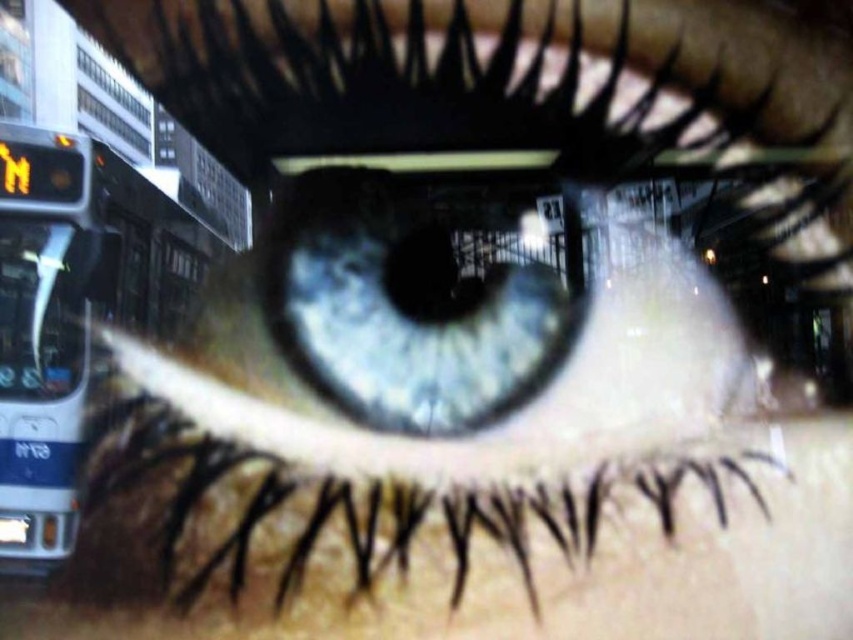
From the picture: You are a photographer trying to focus on the blue iridescent eye at center in the image. However, you notice the white plastic bus at left is slightly out of focus. Based on their positions, can you determine which object is closer to the camera?

The blue iridescent eye at center is closer to the camera than the white plastic bus at left because the bus is described as being behind the eye.

You are standing in front of a large painting of an eye. The painting is exactly like the blue iridescent eye at center in the image. If you want to view the painting from a distance where you can see its intricate details clearly, would standing 5.45 feet away be appropriate?

The blue iridescent eye at center and viewer are 5.45 feet apart, so standing at this distance would allow you to view the intricate details of the painting clearly.